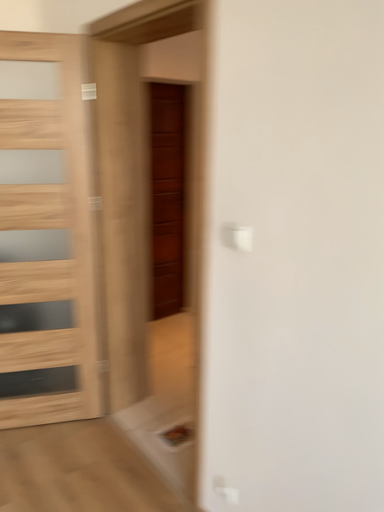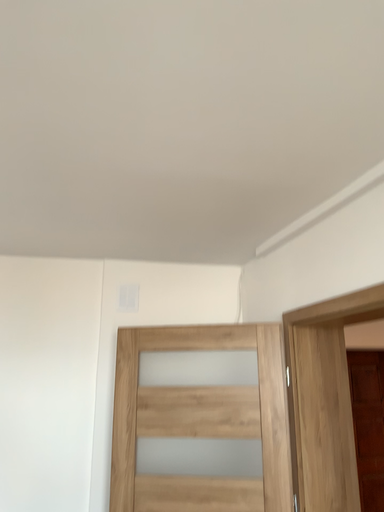
Question: How did the camera likely rotate when shooting the video?

Choices:
 (A) rotated left
 (B) rotated right

Answer: (A)